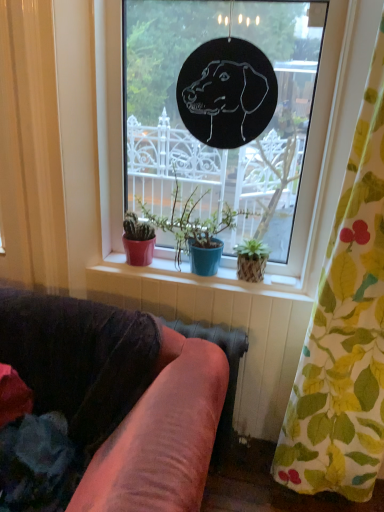
Question: Does point tap(365, 446) appear closer or farther from the camera than point tap(107, 287)?

Choices:
 (A) closer
 (B) farther

Answer: (A)

Question: From their relative heights in the image, would you say floral fabric curtain at right is taller or shorter than matte ceramic pots at center?

Choices:
 (A) tall
 (B) short

Answer: (A)

Question: Estimate the real-world distances between objects in this image. Which object is farther from the matte ceramic pots at center?

Choices:
 (A) black paper dog at center
 (B) matte red pot at center
 (C) velvet pink couch at lower left
 (D) floral fabric curtain at right

Answer: (D)

Question: Estimate the real-world distances between objects in this image. Which object is closer to the matte ceramic pots at center?

Choices:
 (A) black paper dog at center
 (B) floral fabric curtain at right
 (C) matte red pot at center
 (D) velvet pink couch at lower left

Answer: (C)